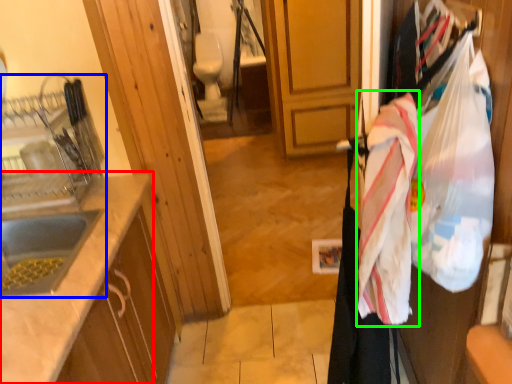
Question: Which object is positioned closest to countertop (highlighted by a red box)? Select from sink (highlighted by a blue box) and blanket (highlighted by a green box).

Choices:
 (A) sink
 (B) blanket

Answer: (A)